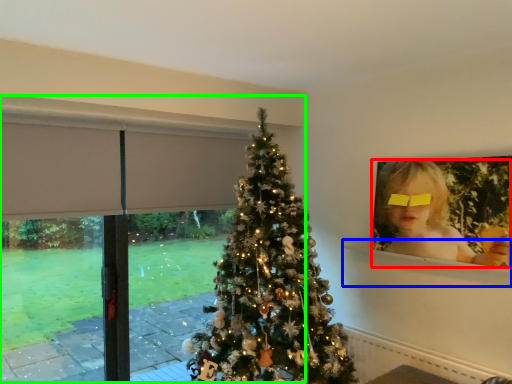
Question: Which object is positioned farthest from person (highlighted by a red box)? Select from window sill (highlighted by a blue box) and window frame (highlighted by a green box).

Choices:
 (A) window sill
 (B) window frame

Answer: (B)